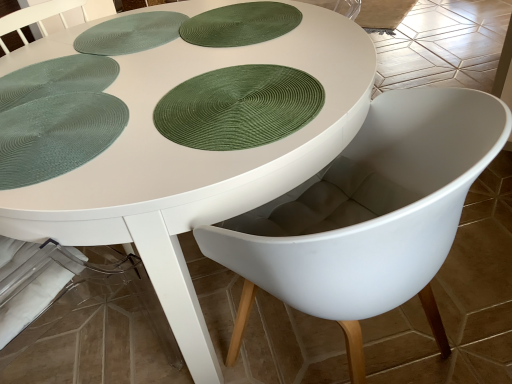
Image resolution: width=512 pixels, height=384 pixels. What are the coordinates of `free area below green woven placemat at center, which is counted as the third paper plate, starting from the top (from a real-world perspective)` in the screenshot? It's located at (217, 98).